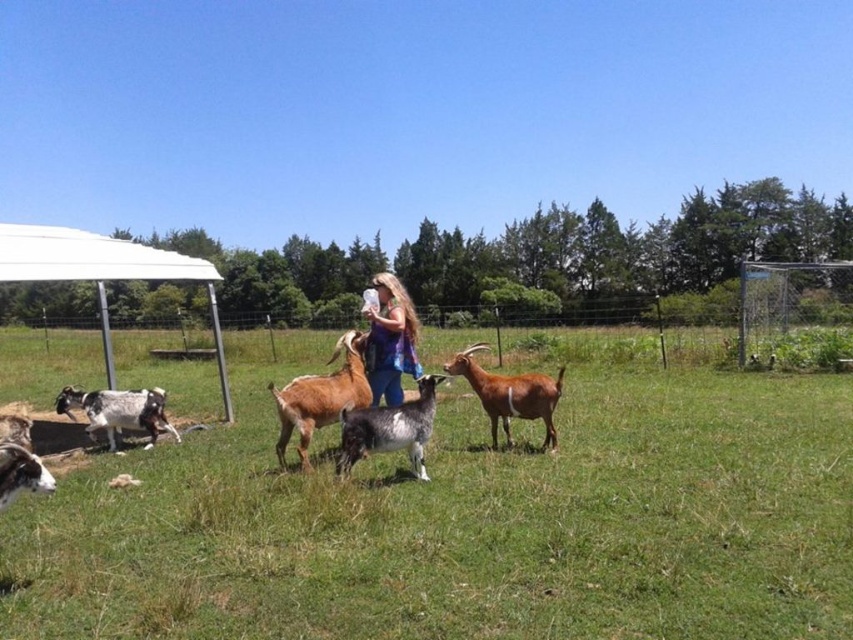
Between speckled fur goat at lower left and white woolen goat at lower left, which one is positioned higher?

white woolen goat at lower left is higher up.

The height and width of the screenshot is (640, 853). I want to click on speckled fur goat at lower left, so click(119, 412).

Can you confirm if brown fuzzy goat at center is shorter than gray speckled fur goat at center?

In fact, brown fuzzy goat at center may be taller than gray speckled fur goat at center.

Locate an element on the screen. This screenshot has width=853, height=640. brown fuzzy goat at center is located at coordinates (320, 396).

Identify the location of brown fuzzy goat at center. Image resolution: width=853 pixels, height=640 pixels. (320, 396).

Between point (379, 291) and point (167, 424), which one is positioned in front?

Point (379, 291)

Looking at this image, is vibrant tie-dye shirt at center above speckled fur goat at lower left?

Correct, vibrant tie-dye shirt at center is located above speckled fur goat at lower left.

Is point (395, 381) in front of point (99, 396)?

Yes, it is.

Where is `vibrant tie-dye shirt at center`? vibrant tie-dye shirt at center is located at coordinates (390, 339).